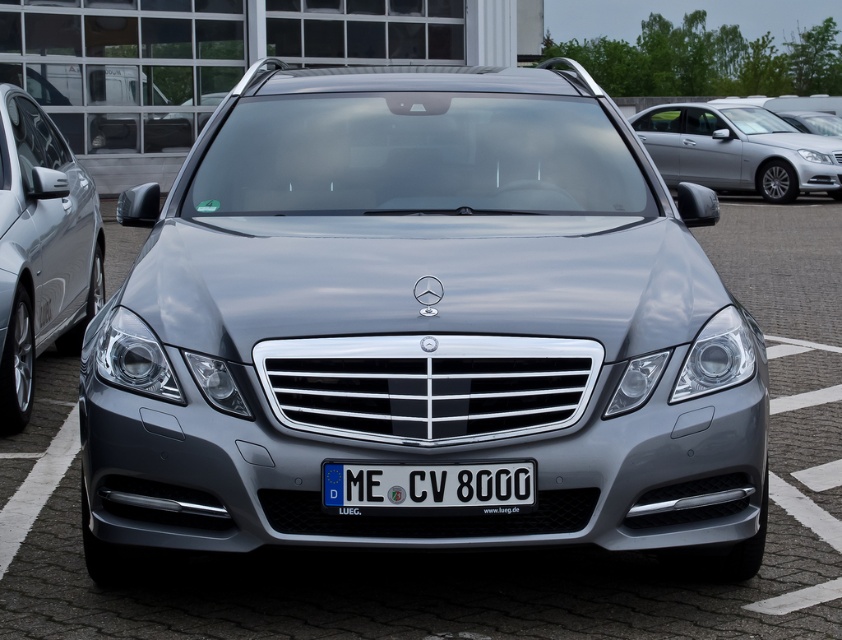
Can you confirm if satin silver car at left is positioned above black plastic license plate at center?

Correct, satin silver car at left is located above black plastic license plate at center.

Which is more to the left, satin silver car at left or black plastic license plate at center?

satin silver car at left

Who is more distant from viewer, (x=46, y=344) or (x=473, y=502)?

Positioned behind is point (x=46, y=344).

The height and width of the screenshot is (640, 842). Identify the location of satin silver car at left. (41, 250).

Does satin silver car at left appear on the right side of satin silver car at upper right?

No, satin silver car at left is not to the right of satin silver car at upper right.

Is point (19, 186) positioned in front of point (825, 166)?

Yes, point (19, 186) is in front of point (825, 166).

What are the coordinates of `satin silver car at left` in the screenshot? It's located at (41, 250).

Between satin metallic car at center and satin silver car at upper right, which one appears on the left side from the viewer's perspective?

satin metallic car at center is more to the left.

Based on the photo, is satin metallic car at center above satin silver car at upper right?

No, satin metallic car at center is not above satin silver car at upper right.

Who is more distant from viewer, (587, 104) or (803, 180)?

The point (803, 180) is more distant.

The width and height of the screenshot is (842, 640). Find the location of `satin metallic car at center`. satin metallic car at center is located at coordinates (421, 326).